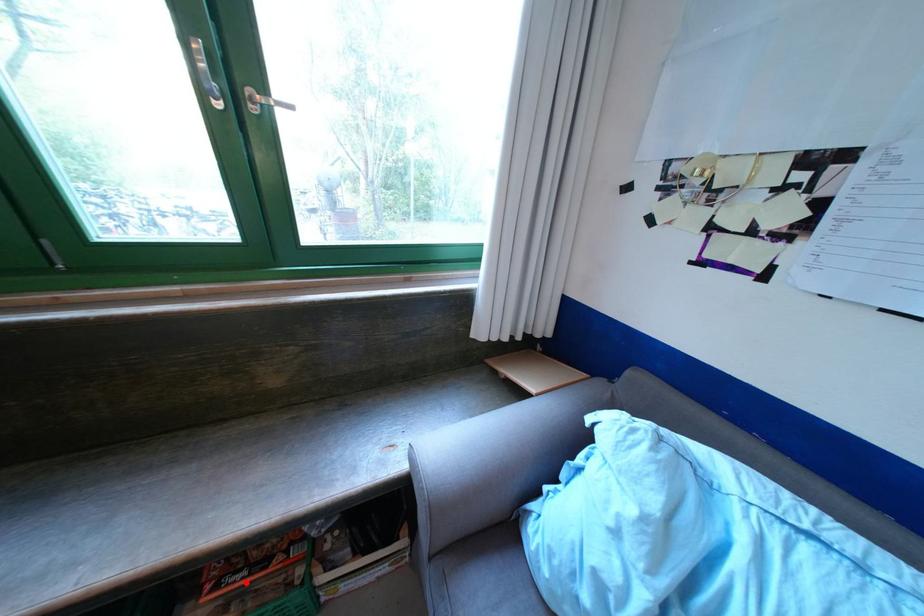
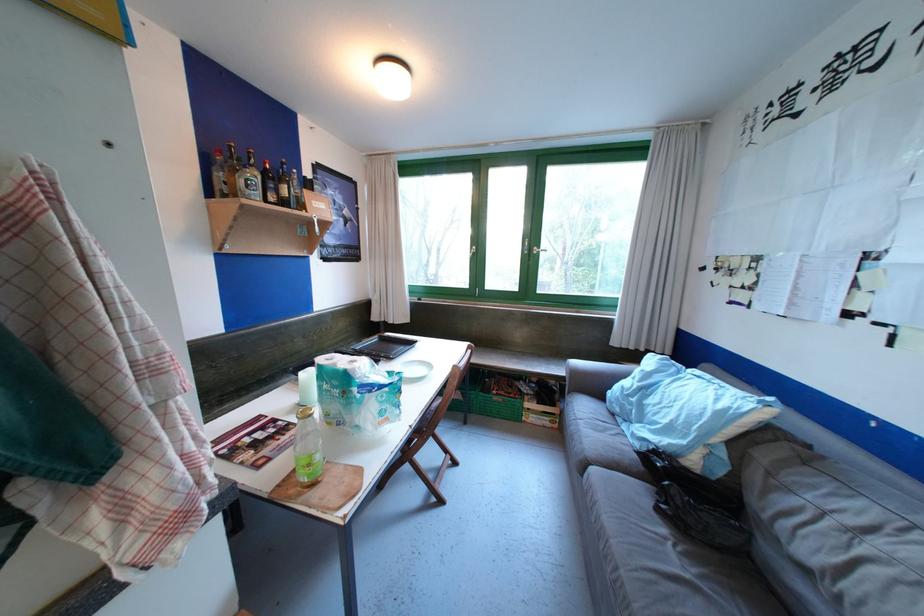
The point at the highlighted location is marked in the first image. Where is the corresponding point in the second image?

(509, 394)